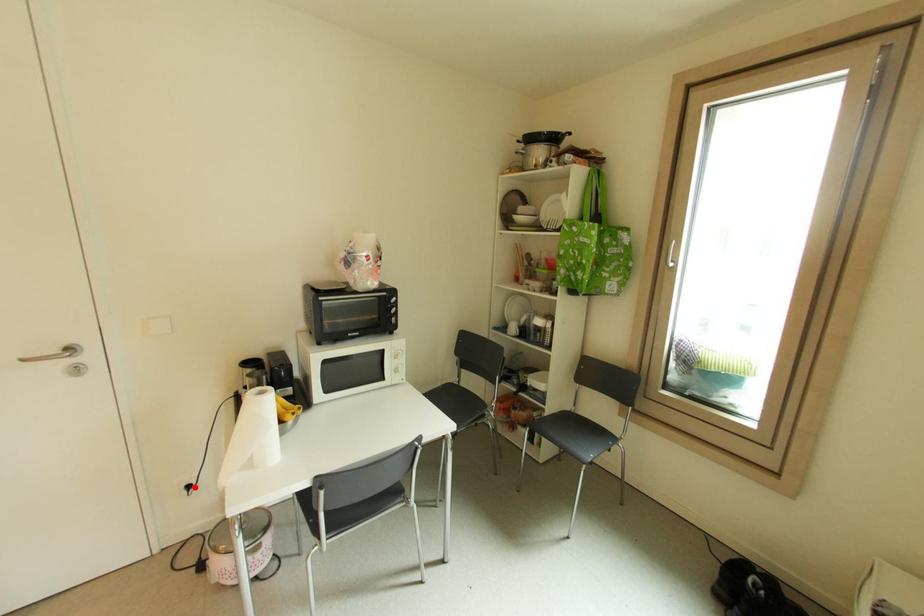
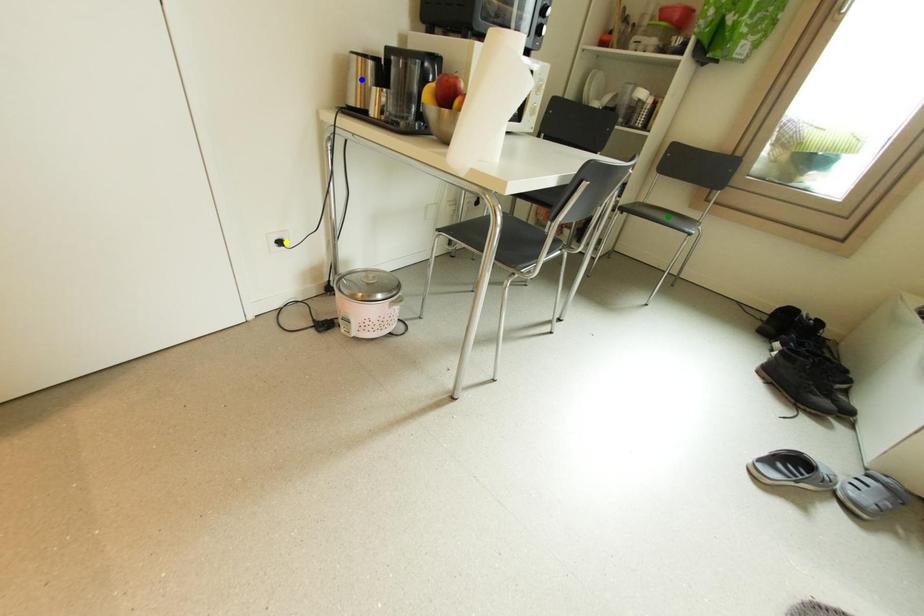
Question: I am providing you with two images of the same scene from different viewpoints. A red point is marked on the first image. You are given multiple points on the second image. Which point in image 2 represents the same 3d spot as the red point in image 1?

Choices:
 (A) green point
 (B) yellow point
 (C) blue point

Answer: (B)